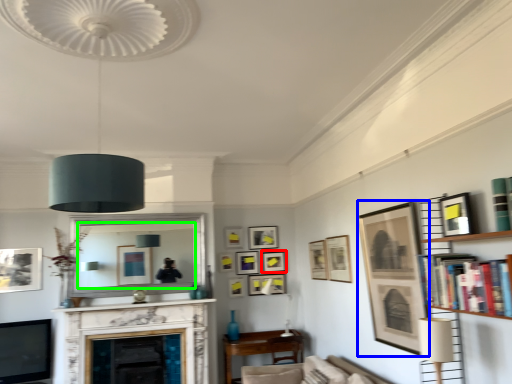
Question: Considering the real-world distances, which object is closest to picture frame (highlighted by a red box)? picture frame (highlighted by a blue box) or mirror (highlighted by a green box).

Choices:
 (A) picture frame
 (B) mirror

Answer: (B)